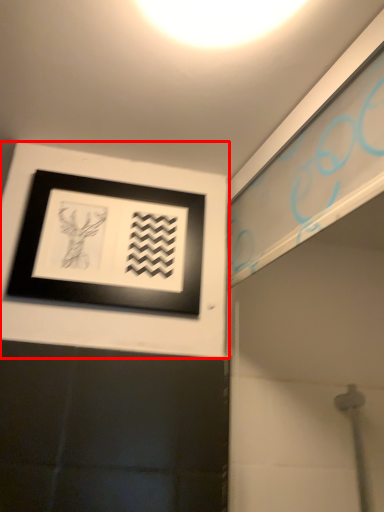
Question: From the image, what is the correct spatial relationship of picture frame (annotated by the red box) in relation to light?

Choices:
 (A) right
 (B) left

Answer: (B)